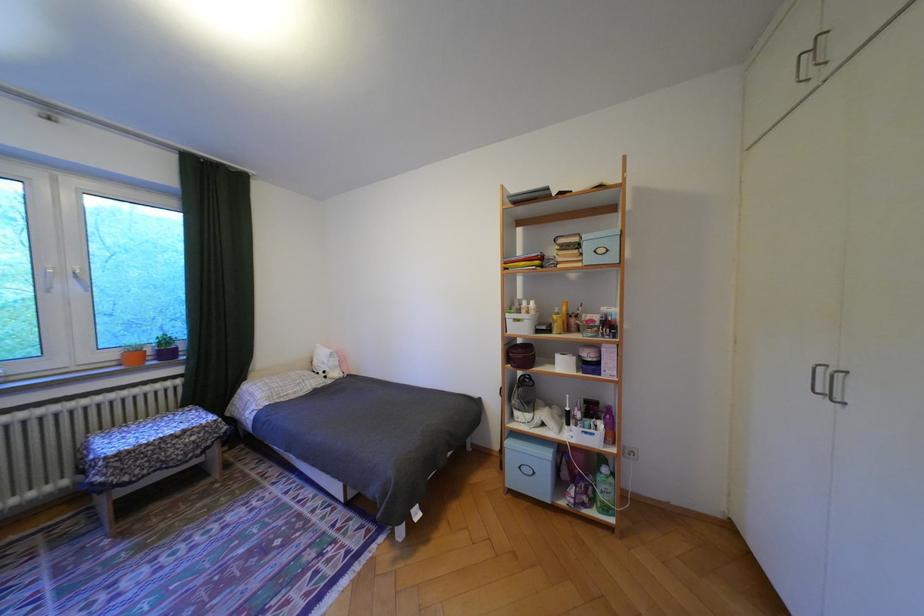
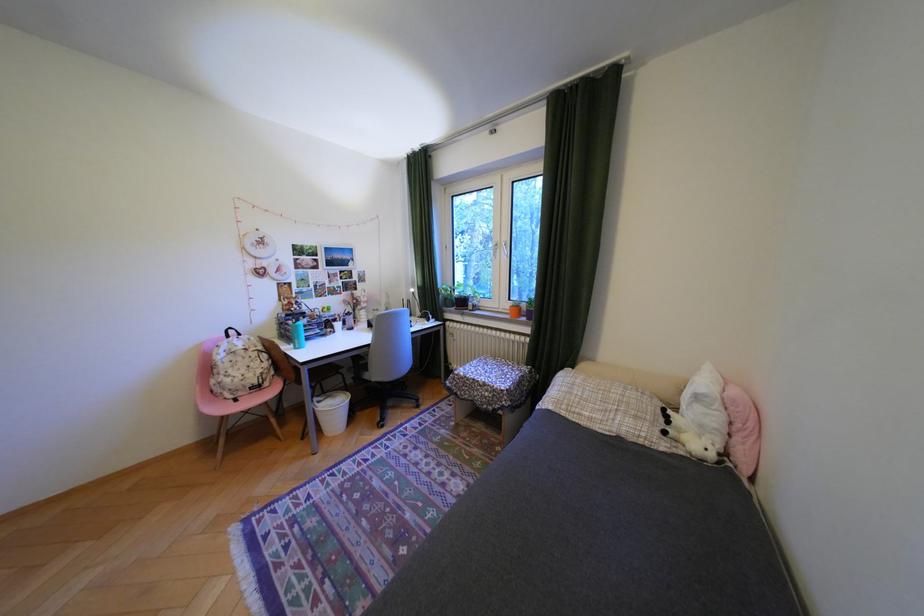
In the second image, find the point that corresponds to point 344,360 in the first image.

(710, 408)